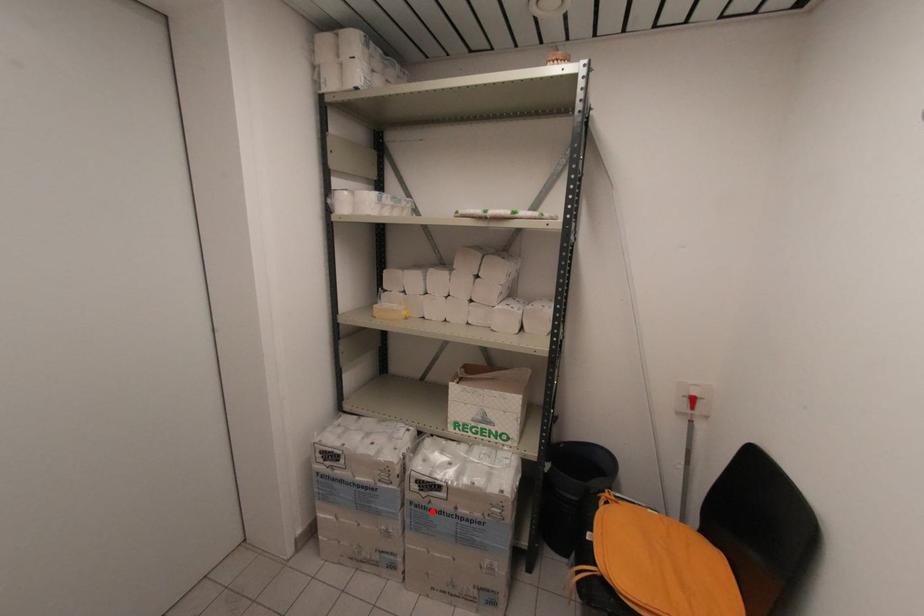
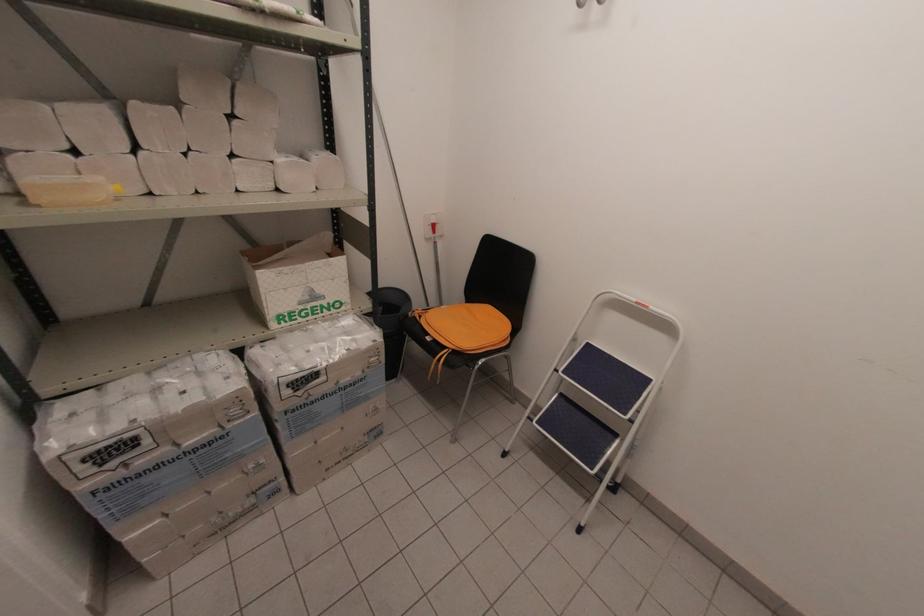
Question: I am providing you with two images of the same scene from different viewpoints. Image1 has a red point marked. In image2, the corresponding 3D location appears at what relative position? Reply with the corresponding letter.

Choices:
 (A) Closer
 (B) Farther

Answer: (A)